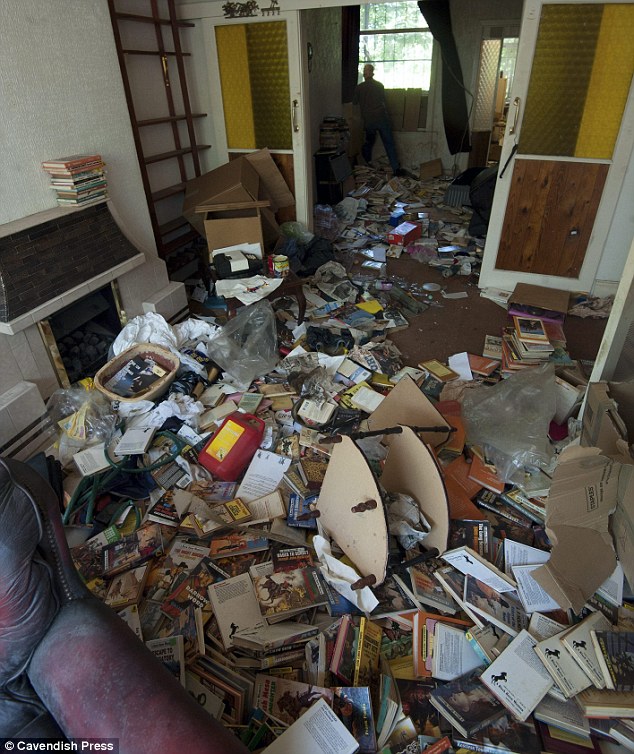
Find the location of a particular element. This screenshot has width=634, height=754. mantle is located at coordinates (51, 221).